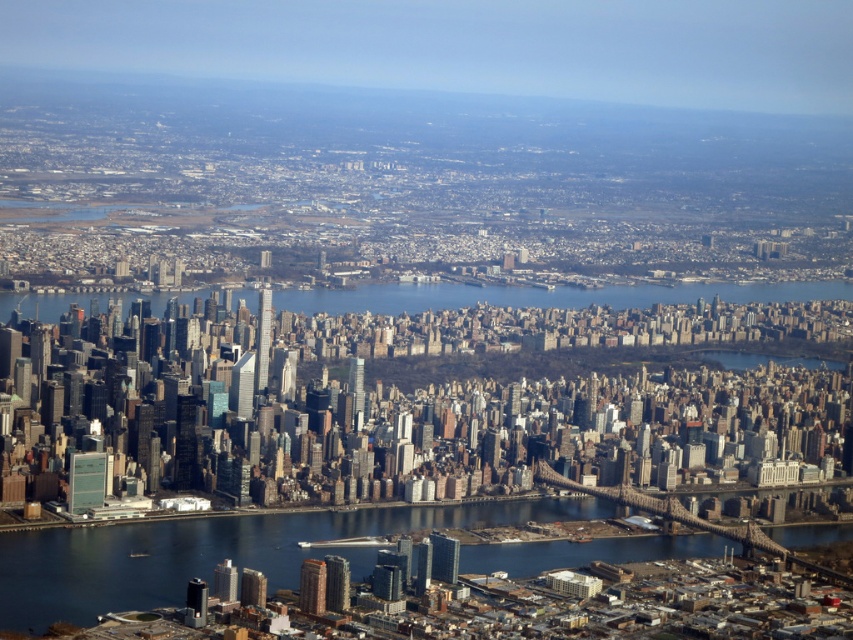
Does blue water at lower center have a greater height compared to blue water at center?

Correct, blue water at lower center is much taller as blue water at center.

Does blue water at lower center appear under blue water at center?

Correct, blue water at lower center is located below blue water at center.

Is point (465, 550) farther from camera compared to point (601, 301)?

That is True.

Find the location of a particular element. This screenshot has height=640, width=853. blue water at lower center is located at coordinates [207, 552].